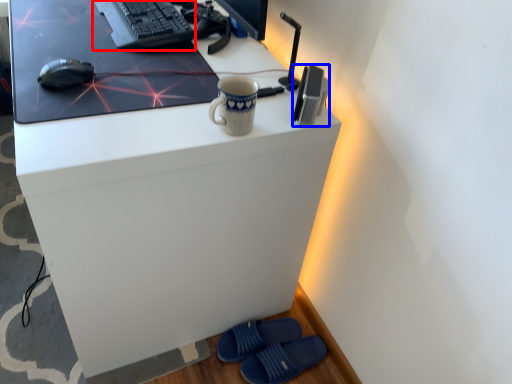
Question: Which object appears closest to the camera in this image, computer keyboard (highlighted by a red box) or gadget (highlighted by a blue box)?

Choices:
 (A) computer keyboard
 (B) gadget

Answer: (B)